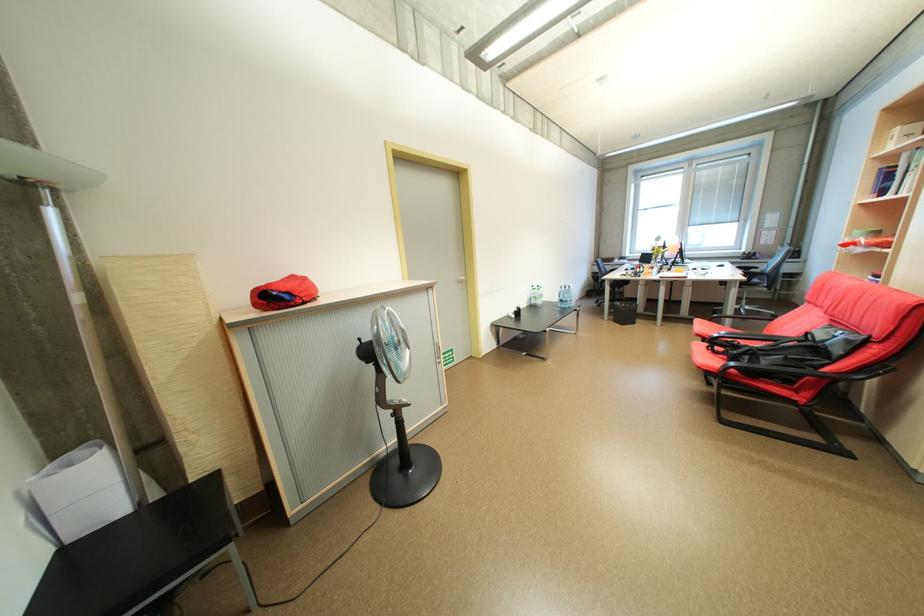
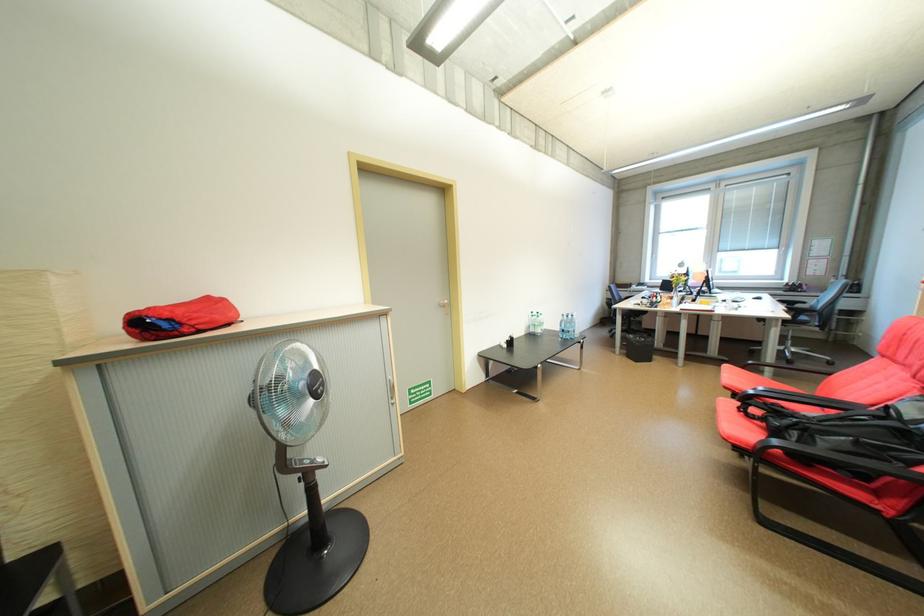
In the second image, find the point that corresponds to (x=723, y=264) in the first image.

(758, 296)